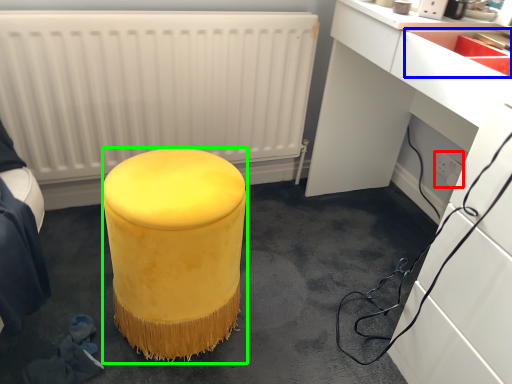
Question: Estimate the real-world distances between objects in this image. Which object is farther from electric outlet (highlighted by a red box), sink (highlighted by a blue box) or furniture (highlighted by a green box)?

Choices:
 (A) sink
 (B) furniture

Answer: (B)